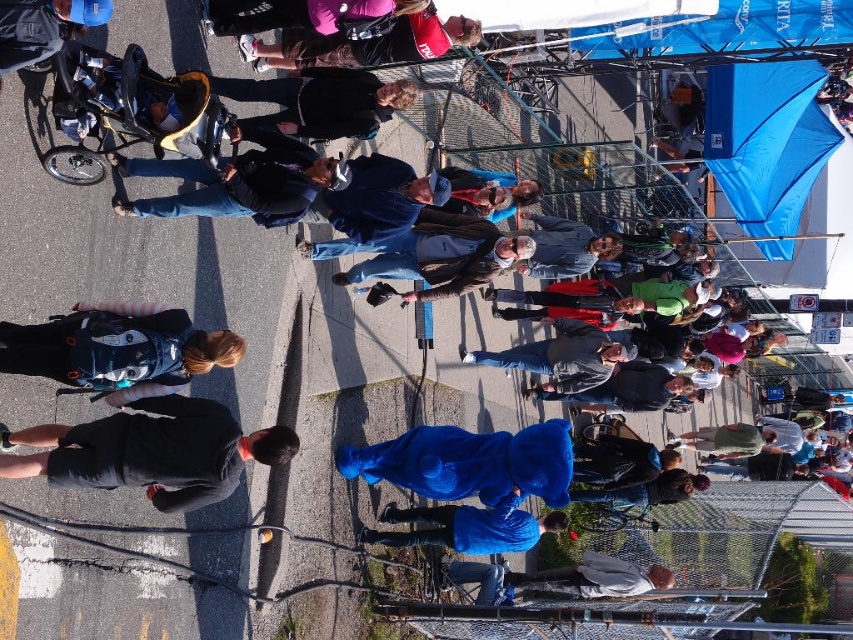
Question: Can you confirm if matte blue backpack at left is positioned above gray fabric jacket at lower center?

Choices:
 (A) yes
 (B) no

Answer: (A)

Question: Which point is closer to the camera?

Choices:
 (A) (213, 109)
 (B) (64, 458)

Answer: (B)

Question: Does matte blue backpack at left come behind blue plush bear at center?

Choices:
 (A) no
 (B) yes

Answer: (A)

Question: Is the position of black matte shorts at lower left more distant than that of black plastic baby carriage at upper left?

Choices:
 (A) yes
 (B) no

Answer: (B)

Question: Estimate the real-world distances between objects in this image. Which object is closer to the blue fleece jacket at lower center?

Choices:
 (A) black matte shorts at lower left
 (B) matte pink jacket at upper center
 (C) black plastic baby carriage at upper left
 (D) matte blue backpack at left

Answer: (B)

Question: Which object appears farthest from the camera in this image?

Choices:
 (A) black plastic baby carriage at upper left
 (B) matte pink jacket at upper center

Answer: (B)